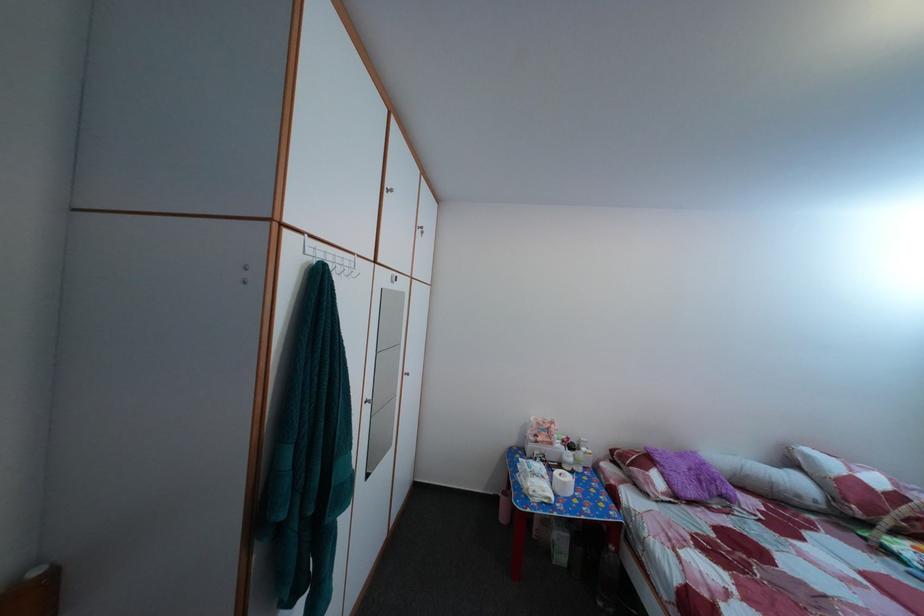
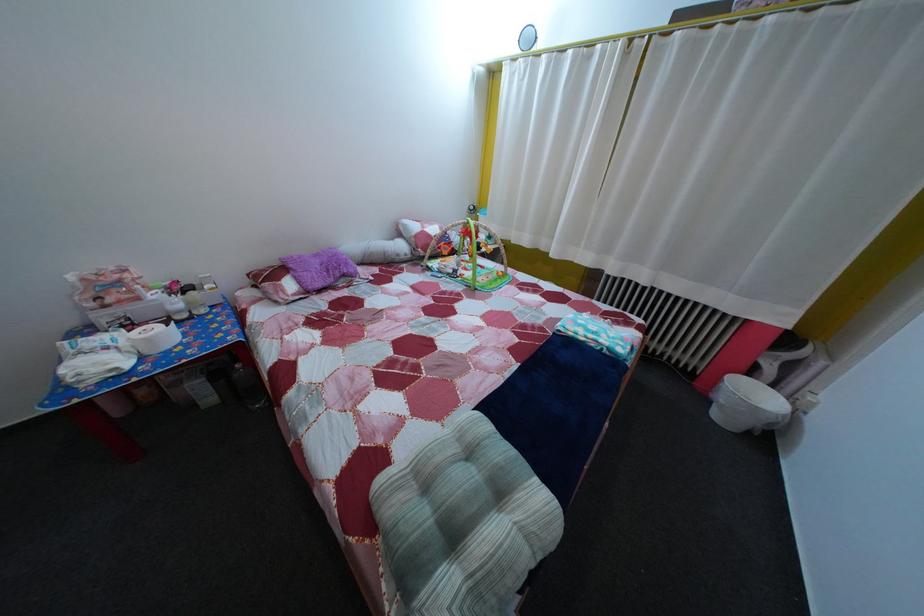
Find the pixel in the second image that matches pixel 689 464 in the first image.

(325, 262)